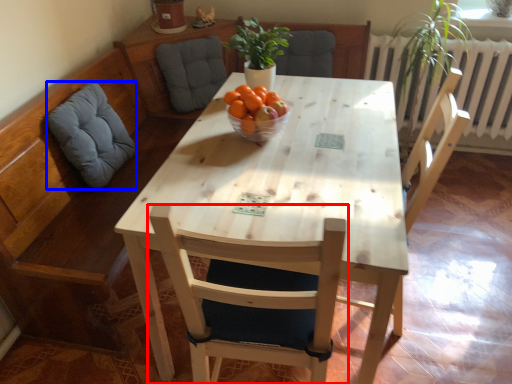
Question: Among these objects, which one is nearest to the camera, chair (highlighted by a red box) or swivel chair (highlighted by a blue box)?

Choices:
 (A) chair
 (B) swivel chair

Answer: (A)